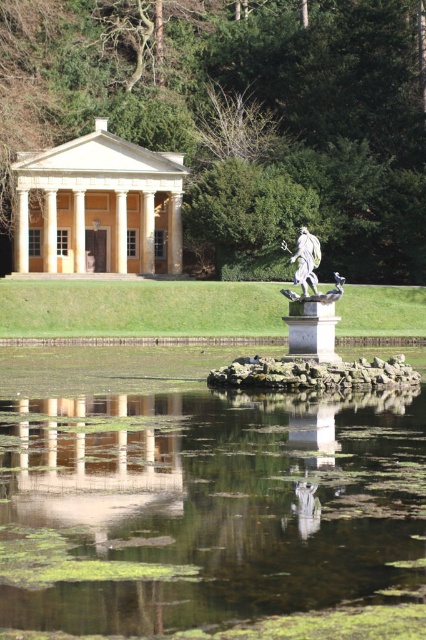
Which is behind, point (25, 173) or point (305, 248)?

The point (25, 173) is behind.

Does point (176, 202) come behind point (294, 259)?

Yes, point (176, 202) is behind point (294, 259).

Is point (115, 154) farther from camera compared to point (305, 253)?

Yes, it is behind point (305, 253).

In order to click on beige stone palace at upper left in this screenshot , I will do `click(98, 205)`.

Is green algae water at center positioned in front of beige stone palace at upper left?

Yes, it is.

What do you see at coordinates (213, 515) in the screenshot? The image size is (426, 640). I see `green algae water at center` at bounding box center [213, 515].

Locate an element on the screen. The width and height of the screenshot is (426, 640). green algae water at center is located at coordinates (213, 515).

Who is more distant from viewer, (160, 461) or (308, 269)?

The point (308, 269) is behind.

Is point (57, 564) more distant than point (305, 296)?

No, (57, 564) is in front of (305, 296).

Locate an element on the screen. The width and height of the screenshot is (426, 640). green algae water at center is located at coordinates (213, 515).

The width and height of the screenshot is (426, 640). Find the location of `green algae water at center`. green algae water at center is located at coordinates coord(213,515).